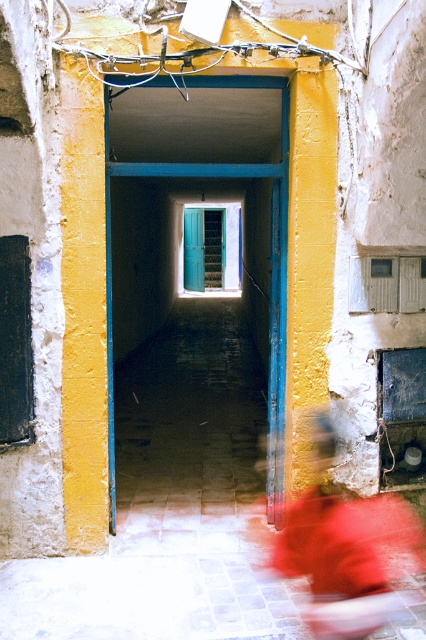
In the scene shown: You are a delivery person trying to navigate through the alleyway. You notice the red fabric at lower right and the teal wooden door at center. Which object is wider?

The red fabric at lower right is wider than the teal wooden door at center.

You are standing at the entrance of the alleyway and notice a red fabric at lower right and a blue wooden door at center. Which object is closer to you?

The red fabric at lower right is closer to you since it is positioned at the lower part of the image, which typically corresponds to the foreground in such scenes.